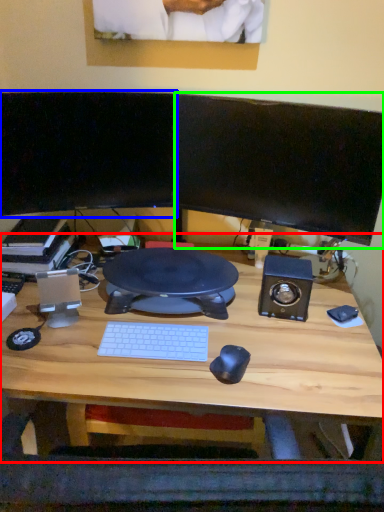
Question: Estimate the real-world distances between objects in this image. Which object is closer to desk (highlighted by a red box), computer monitor (highlighted by a blue box) or computer monitor (highlighted by a green box)?

Choices:
 (A) computer monitor
 (B) computer monitor

Answer: (B)